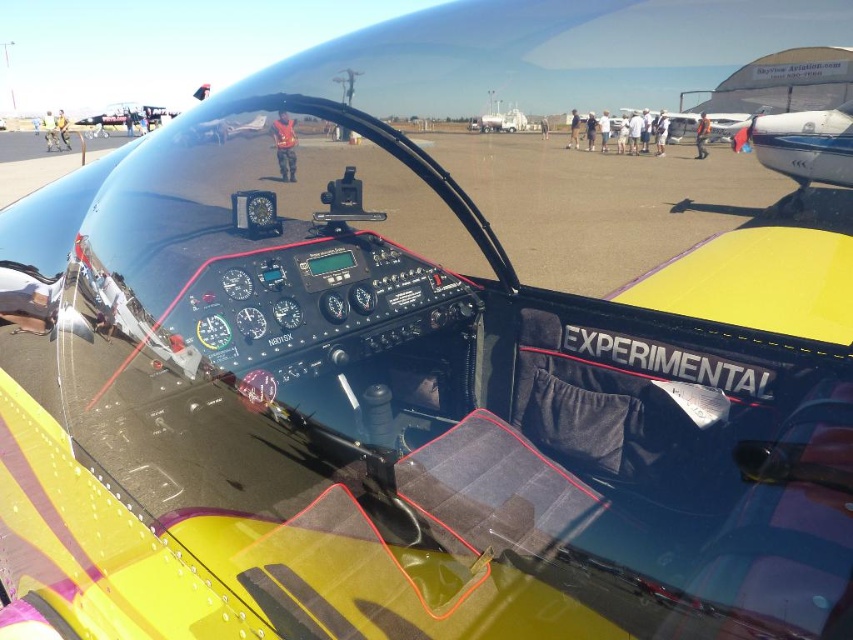
You are a pilot inside the cockpit and need to identify the position of two points on the instrument panel. The first point is labeled as point (762,147) and the second is point (288,132). According to the cockpit layout, which point is located further back relative to the pilot?

Point (762,147) is behind point (288,132), so it is located further back relative to the pilot.

You are a pilot preparing for takeoff in this experimental aircraft. You need to check the distance between the metallic blue propeller at right and the nearest person on the tarmac. Can you confirm if the distance is safe for engine startup? The safety regulation requires at least 30 feet distance to prevent injury from the propeller.

The metallic blue propeller at right and the nearest person on the tarmac are 33.91 feet apart, which exceeds the 30 feet safety requirement. Therefore, the distance is safe for engine startup.

As a pilot in the cockpit, you notice the metallic blue propeller at right and the yellow matte airplane at center. Which object is positioned to the right of the other?

The metallic blue propeller at right is to the right of the yellow matte airplane at center.